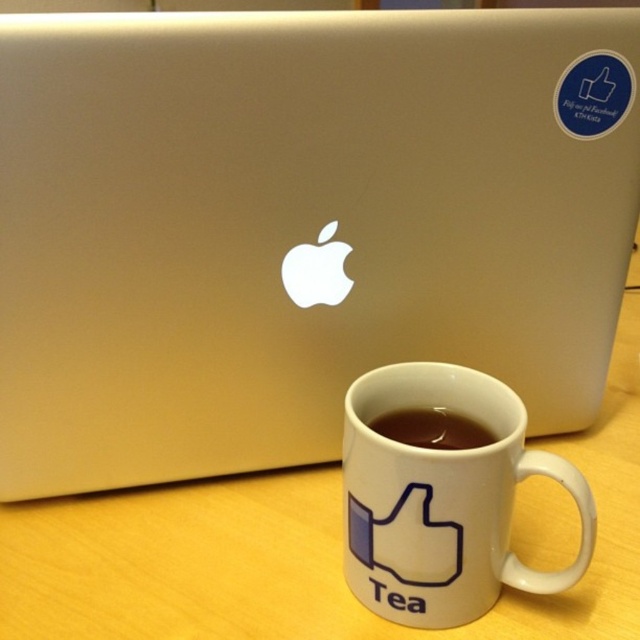
You are standing in front of the workspace shown in the image. You need to place a small note on the desk near the white ceramic mug at lower center. According to the coordinates provided, where should you place the note?

The white ceramic mug at lower center is located at coordinates point (x=442, y=499), so you should place the note near that position.

You are a delivery robot with a 12 inch arm. You need to pick up the white ceramic mug at lower center. Can your arm reach it?

The white ceramic mug at lower center is 14.28 inches away from the camera, which is farther than the robot arm length of 12 inches. The robot arm cannot reach it.

You are organizing the desk items. You need to move the white ceramic mug at lower center and the brown matte coffee at center. Which object should you move first to access the other?

You should move the white ceramic mug at lower center first because it is in front of the brown matte coffee at center, so moving it will allow access to the brown matte coffee at center.